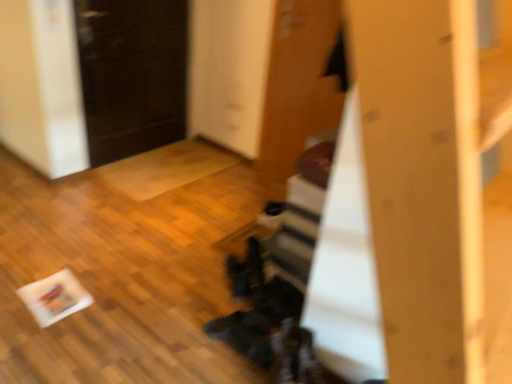
The width and height of the screenshot is (512, 384). I want to click on free area in between black glossy door at upper left, the first door in the left-to-right sequence, and wooden door at upper center, which is the 2th door from left to right, so click(x=195, y=174).